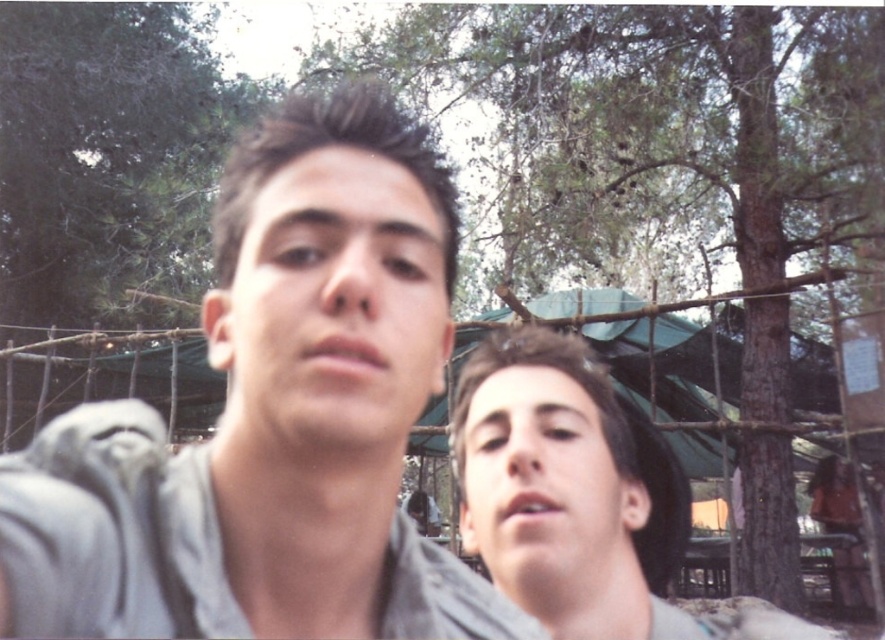
Question: Does green leafy tree at upper center appear under smooth skin face at lower right?

Choices:
 (A) yes
 (B) no

Answer: (B)

Question: Which of these objects is positioned farthest from the gray matte shirt at center?

Choices:
 (A) green leafy tree at upper center
 (B) smooth skin face at center

Answer: (A)

Question: Which of the following is the closest to the observer?

Choices:
 (A) (379, 586)
 (B) (521, 540)
 (C) (528, 212)

Answer: (A)

Question: Can you confirm if gray matte shirt at center is positioned above smooth skin face at center?

Choices:
 (A) yes
 (B) no

Answer: (B)

Question: Can you confirm if smooth skin face at center is positioned below smooth skin face at lower right?

Choices:
 (A) no
 (B) yes

Answer: (A)

Question: Among these objects, which one is farthest from the camera?

Choices:
 (A) smooth skin face at lower right
 (B) green leafy tree at upper center
 (C) smooth skin face at center

Answer: (B)